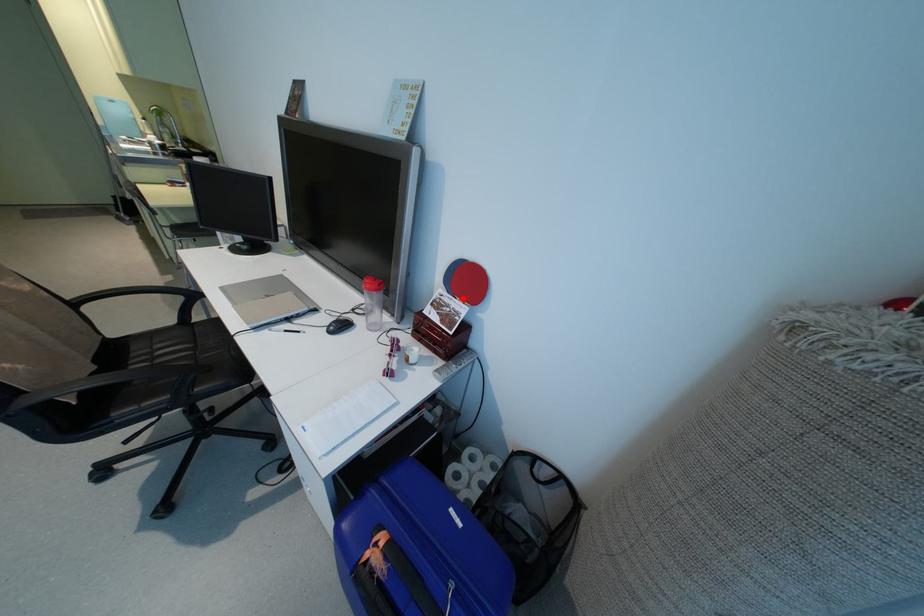
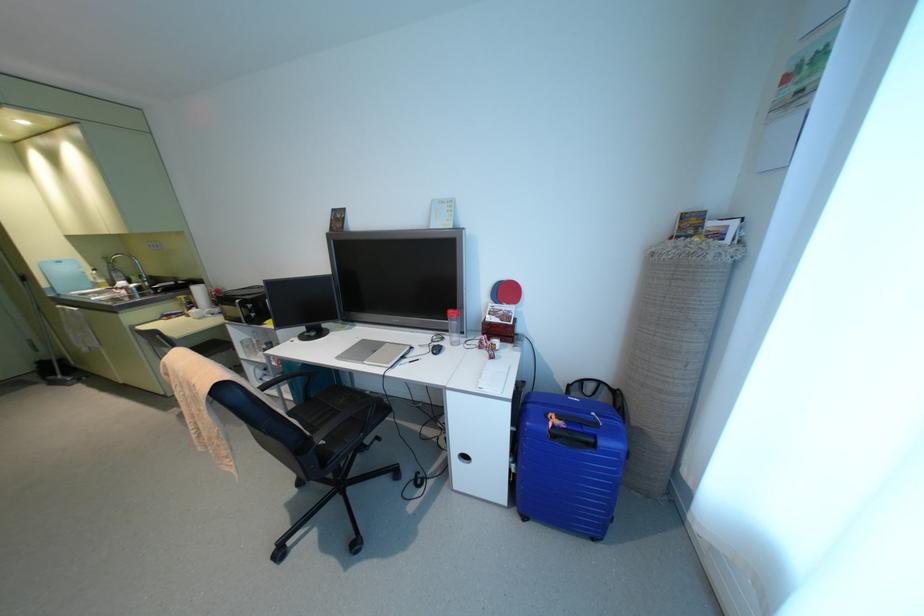
Find the pixel in the second image that matches the highlighted location in the first image.

(507, 302)